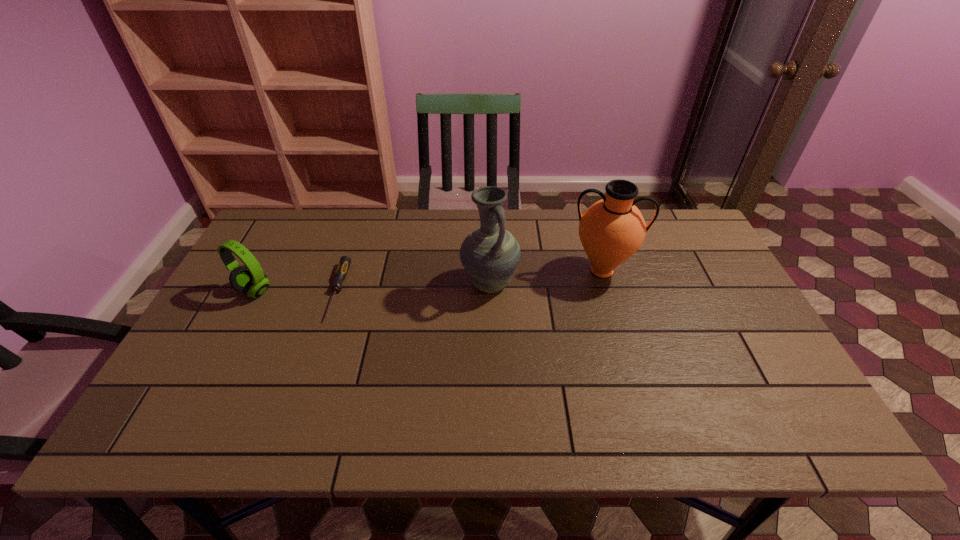
Where is `the third object from left to right`? This screenshot has width=960, height=540. the third object from left to right is located at coordinates (490, 254).

You are a GUI agent. You are given a task and a screenshot of the screen. Output one action in this format:
    pyautogui.click(x=<x>, y=<y>)
    Task: Click on the rightmost object
    This screenshot has height=540, width=960.
    Given the screenshot: What is the action you would take?
    pyautogui.click(x=611, y=230)

In order to click on the third tallest object in this screenshot , I will do `click(249, 278)`.

The width and height of the screenshot is (960, 540). In order to click on the leftmost object in this screenshot , I will do click(249, 278).

Find the location of a particular element. This screenshot has height=540, width=960. the shortest object is located at coordinates (344, 263).

The width and height of the screenshot is (960, 540). Find the location of `the second object from left to right`. the second object from left to right is located at coordinates (344, 263).

Where is `blank space located 0.060m on the handle side of the second object from right to left`? The width and height of the screenshot is (960, 540). blank space located 0.060m on the handle side of the second object from right to left is located at coordinates (491, 321).

Where is `vacant point located 0.100m on the right of the right pitcher`? Image resolution: width=960 pixels, height=540 pixels. vacant point located 0.100m on the right of the right pitcher is located at coordinates (669, 271).

What are the coordinates of `free spot located on the right of the leftmost object` in the screenshot? It's located at (305, 291).

In order to click on free space located 0.250m insert the third object from right to left into a screw head in this screenshot , I will do `click(300, 407)`.